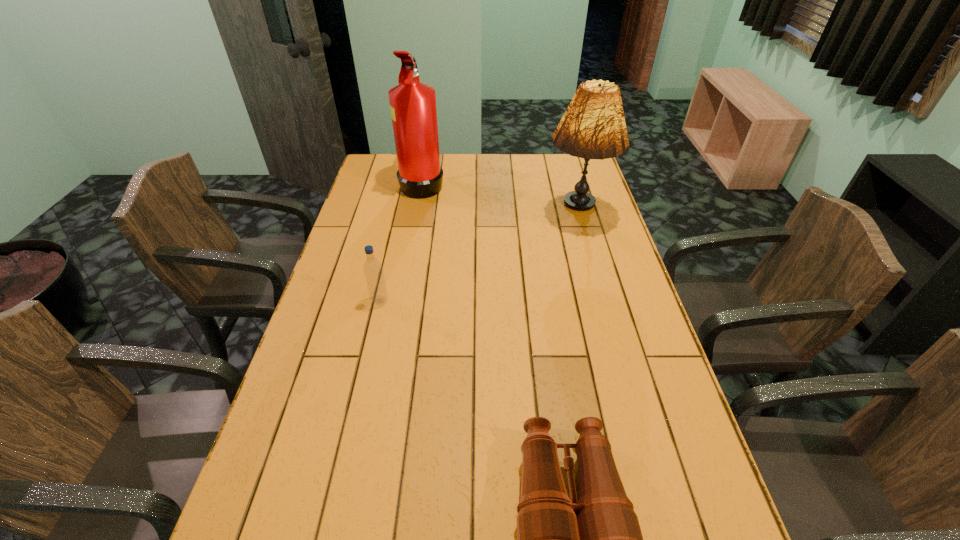
This screenshot has height=540, width=960. What are the coordinates of `object that is at the right edge` in the screenshot? It's located at (593, 126).

Where is `object that is at the far left corner`? Image resolution: width=960 pixels, height=540 pixels. object that is at the far left corner is located at coordinates [x=412, y=103].

Find the location of a particular element. Image resolution: width=960 pixels, height=540 pixels. free location at the left edge of the desktop is located at coordinates (359, 248).

Where is `vacant space at the right edge of the desktop`? vacant space at the right edge of the desktop is located at coordinates (667, 427).

I want to click on unoccupied area between the lampshade and the second shortest object, so click(478, 258).

This screenshot has width=960, height=540. Identify the location of vacant area that lies between the fire extinguisher and the third farthest object. (401, 242).

Locate an element on the screen. The image size is (960, 540). free space between the second nearest object and the lampshade is located at coordinates (478, 258).

At what (x,y) coordinates should I click in order to perform the action: click on free area in between the fire extinguisher and the third farthest object. Please return your answer as a coordinate pair (x, y). This screenshot has height=540, width=960. Looking at the image, I should click on (401, 242).

You are a GUI agent. You are given a task and a screenshot of the screen. Output one action in this format:
    pyautogui.click(x=<x>, y=<y>)
    Task: Click on the free space between the third tallest object and the lampshade
    The width and height of the screenshot is (960, 540).
    Given the screenshot: What is the action you would take?
    pyautogui.click(x=478, y=258)

Locate an element on the screen. This screenshot has width=960, height=540. the third closest object to the lampshade is located at coordinates (605, 539).